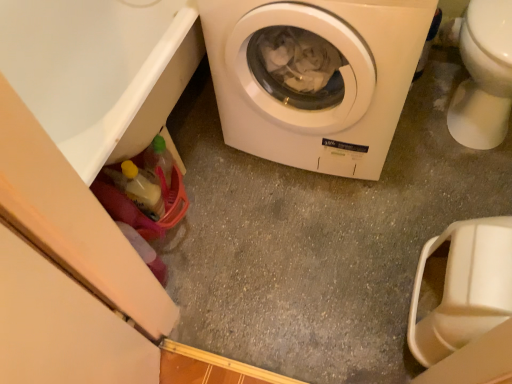
Find the location of a particular element. This screenshot has width=512, height=384. white glossy toilet bowl at right is located at coordinates (482, 74).

This screenshot has width=512, height=384. What do you see at coordinates (482, 74) in the screenshot?
I see `white glossy toilet bowl at right` at bounding box center [482, 74].

Where is `white matte washing machine at center`? white matte washing machine at center is located at coordinates (314, 77).

Consider the image. Measure the distance between white matte washing machine at center and camera.

white matte washing machine at center is 92.23 centimeters away from camera.

The height and width of the screenshot is (384, 512). What do you see at coordinates (314, 77) in the screenshot? I see `white matte washing machine at center` at bounding box center [314, 77].

Where is `white glossy toilet bowl at right`? The image size is (512, 384). white glossy toilet bowl at right is located at coordinates [x=482, y=74].

Considering the positions of objects white matte washing machine at center and white glossy toilet bowl at right in the image provided, who is more to the left, white matte washing machine at center or white glossy toilet bowl at right?

white matte washing machine at center.

Considering the relative positions of white matte washing machine at center and white glossy toilet bowl at right in the image provided, is white matte washing machine at center in front of white glossy toilet bowl at right?

Yes.

Is point (360, 13) behind point (492, 67)?

No, (360, 13) is in front of (492, 67).

From the image's perspective, which one is positioned lower, white matte washing machine at center or white glossy toilet bowl at right?

white matte washing machine at center is shown below in the image.

From a real-world perspective, is white matte washing machine at center physically above white glossy toilet bowl at right?

Indeed, from a real-world perspective, white matte washing machine at center stands above white glossy toilet bowl at right.

In the scene shown: Is white matte washing machine at center thinner than white glossy toilet bowl at right?

Indeed, white matte washing machine at center has a lesser width compared to white glossy toilet bowl at right.

Is white matte washing machine at center taller than white glossy toilet bowl at right?

Correct, white matte washing machine at center is much taller as white glossy toilet bowl at right.

Considering the sizes of objects white matte washing machine at center and white glossy toilet bowl at right in the image provided, who is bigger, white matte washing machine at center or white glossy toilet bowl at right?

white matte washing machine at center is bigger.

Is white matte washing machine at center situated inside white glossy toilet bowl at right or outside?

white matte washing machine at center is located beyond the bounds of white glossy toilet bowl at right.

Is white matte washing machine at center in contact with white glossy toilet bowl at right?

white matte washing machine at center and white glossy toilet bowl at right are clearly separated.

Consider the image. Is white matte washing machine at center facing away from white glossy toilet bowl at right?

That's not correct — white matte washing machine at center is not looking away from white glossy toilet bowl at right.

What's the angular difference between white matte washing machine at center and white glossy toilet bowl at right's facing directions?

The angle between the facing direction of white matte washing machine at center and the facing direction of white glossy toilet bowl at right is 2.58 degrees.

Where is `toilet bowl above the white matte washing machine at center (from the image's perspective)`? toilet bowl above the white matte washing machine at center (from the image's perspective) is located at coordinates (482, 74).

Looking at this image, is white glossy toilet bowl at right at the left side of white matte washing machine at center?

In fact, white glossy toilet bowl at right is to the right of white matte washing machine at center.

Is the depth of white glossy toilet bowl at right greater than that of white matte washing machine at center?

That is True.

Between point (495, 141) and point (277, 109), which one is positioned in front?

Point (277, 109)

From the image's perspective, which object appears higher, white glossy toilet bowl at right or white matte washing machine at center?

From the image's view, white glossy toilet bowl at right is above.

From a real-world perspective, between white glossy toilet bowl at right and white matte washing machine at center, who is vertically higher?

white matte washing machine at center.

Can you confirm if white glossy toilet bowl at right is thinner than white matte washing machine at center?

In fact, white glossy toilet bowl at right might be wider than white matte washing machine at center.

Between white glossy toilet bowl at right and white matte washing machine at center, which one has more height?

Standing taller between the two is white matte washing machine at center.

Is white glossy toilet bowl at right smaller than white matte washing machine at center?

Indeed, white glossy toilet bowl at right has a smaller size compared to white matte washing machine at center.

In the scene shown: Is white glossy toilet bowl at right spatially inside white matte washing machine at center, or outside of it?

white glossy toilet bowl at right is spatially situated outside white matte washing machine at center.

Are white glossy toilet bowl at right and white matte washing machine at center located far from each other?

No, there isn't a large distance between white glossy toilet bowl at right and white matte washing machine at center.

Is white glossy toilet bowl at right facing towards white matte washing machine at center?

No.

In the image, there is a white matte washing machine at center. Where is `toilet bowl above it (from the image's perspective)`? toilet bowl above it (from the image's perspective) is located at coordinates (482, 74).

Locate an element on the screen. The image size is (512, 384). toilet bowl that appears behind the white matte washing machine at center is located at coordinates [482, 74].

At what (x,y) coordinates should I click in order to perform the action: click on toilet bowl above the white matte washing machine at center (from the image's perspective). Please return your answer as a coordinate pair (x, y). Image resolution: width=512 pixels, height=384 pixels. Looking at the image, I should click on (482, 74).